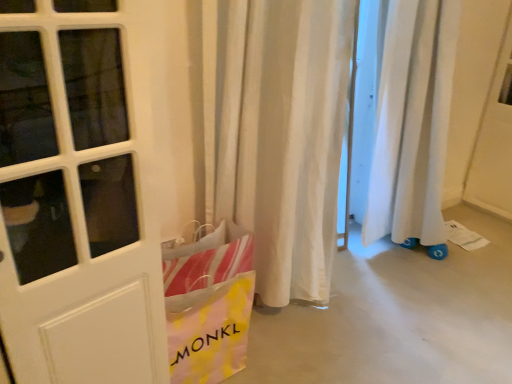
Identify the location of vacant space underneath white fabric curtain at center (from a real-world perspective). The image size is (512, 384). (276, 316).